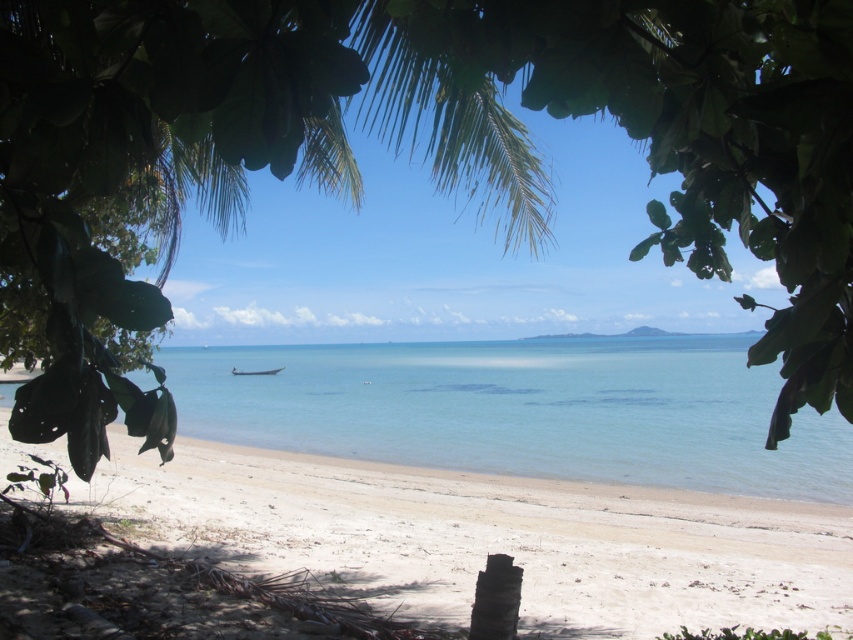
Question: Is white sandy beach at lower center positioned before clear blue water at center?

Choices:
 (A) no
 (B) yes

Answer: (A)

Question: Considering the real-world distances, which object is farthest from the clear blue water at center?

Choices:
 (A) white sandy beach at lower center
 (B) wooden boat at center

Answer: (B)

Question: Does white sandy beach at lower center appear over wooden boat at center?

Choices:
 (A) yes
 (B) no

Answer: (B)

Question: Does clear blue water at center have a larger size compared to wooden boat at center?

Choices:
 (A) yes
 (B) no

Answer: (A)

Question: Which object appears closest to the camera in this image?

Choices:
 (A) white sandy beach at lower center
 (B) wooden boat at center
 (C) clear blue water at center

Answer: (C)

Question: Which of the following is the closest to the observer?

Choices:
 (A) (838, 518)
 (B) (231, 369)
 (C) (759, 385)

Answer: (A)